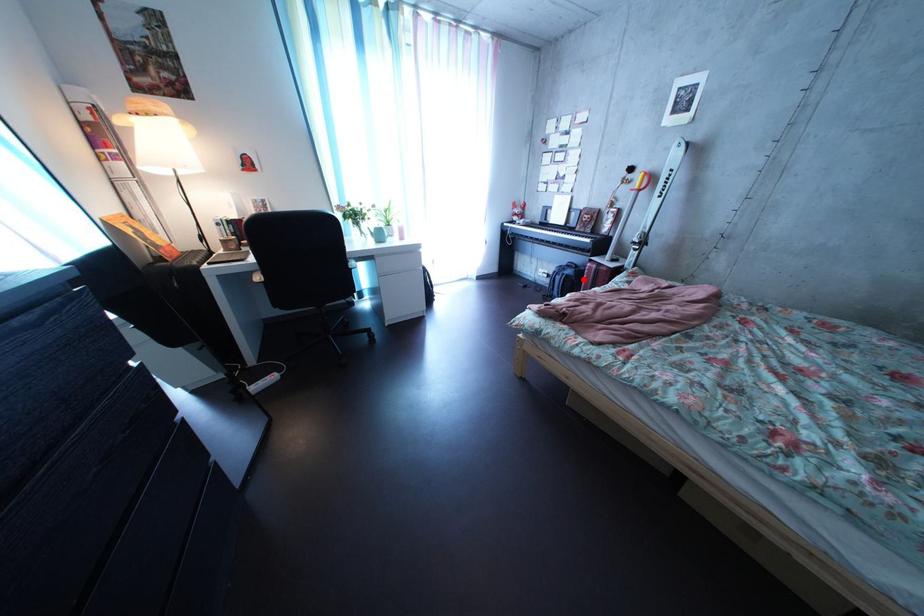
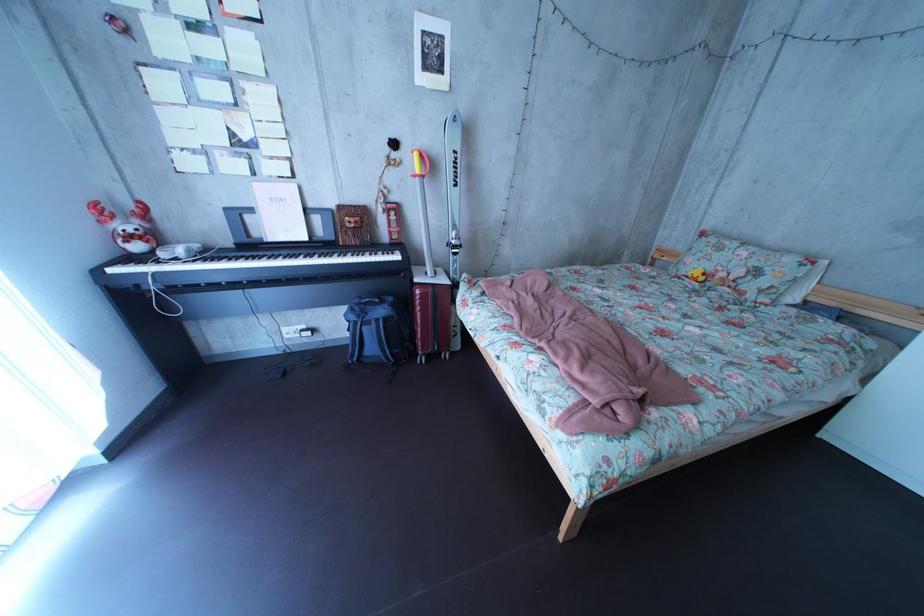
Question: I am providing you with two images of the same scene from different viewpoints. A red point is shown in image1. For the corresponding object point in image2, is it positioned nearer or farther from the camera?

Choices:
 (A) Nearer
 (B) Farther

Answer: (B)